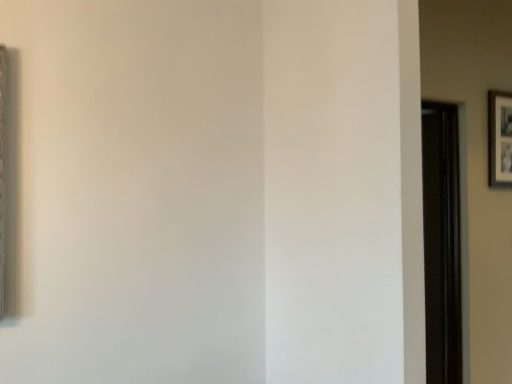
Describe the element at coordinates (500, 138) in the screenshot. I see `black matte picture frame at upper right` at that location.

Identify the location of black matte picture frame at upper right. The height and width of the screenshot is (384, 512). (500, 138).

This screenshot has width=512, height=384. Find the location of `black matte picture frame at upper right`. black matte picture frame at upper right is located at coordinates (500, 138).